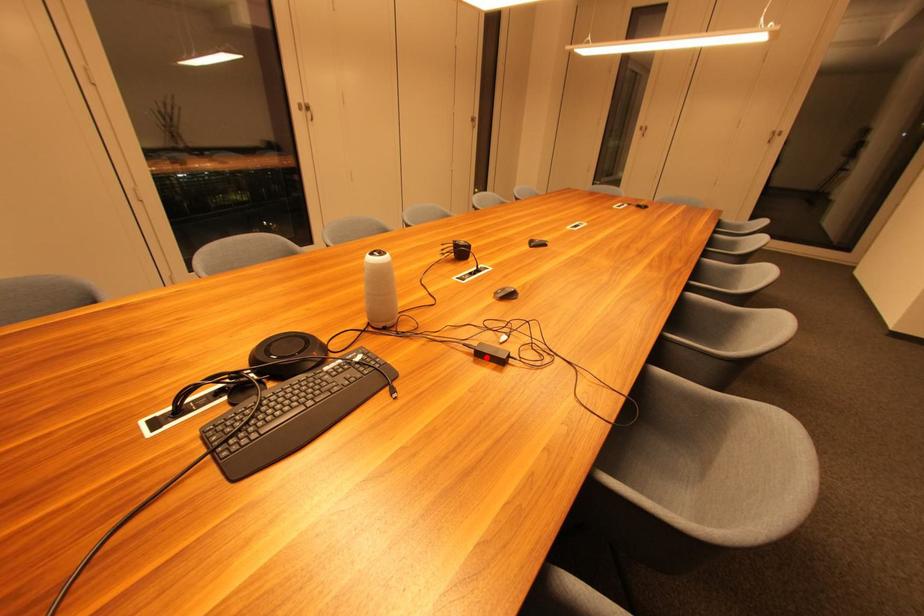
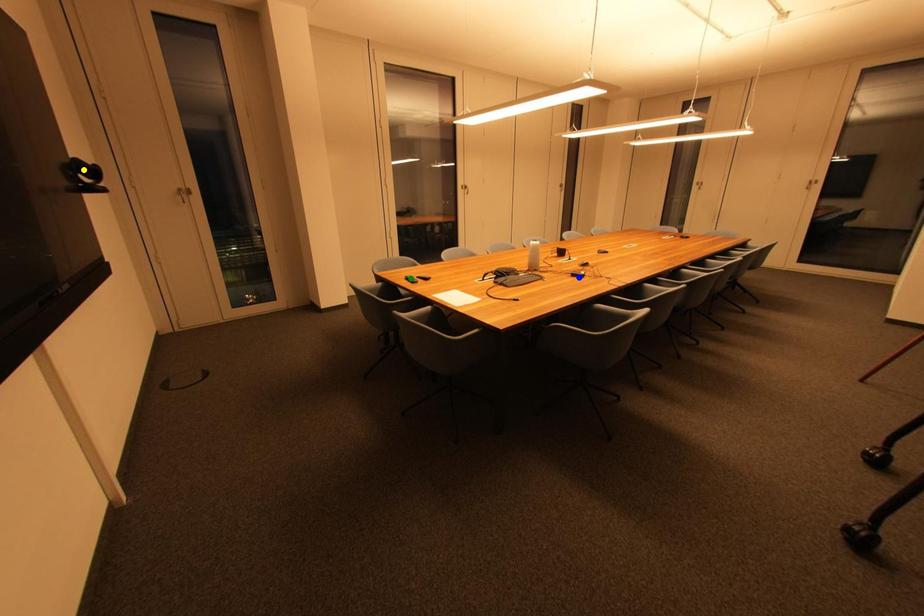
Question: I am providing you with two images of the same scene from different viewpoints. A red point is marked on the first image. You are given multiple points on the second image. Which point in image 2 is actually the same real-world point as the red point in image 1?

Choices:
 (A) green point
 (B) blue point
 (C) yellow point

Answer: (B)